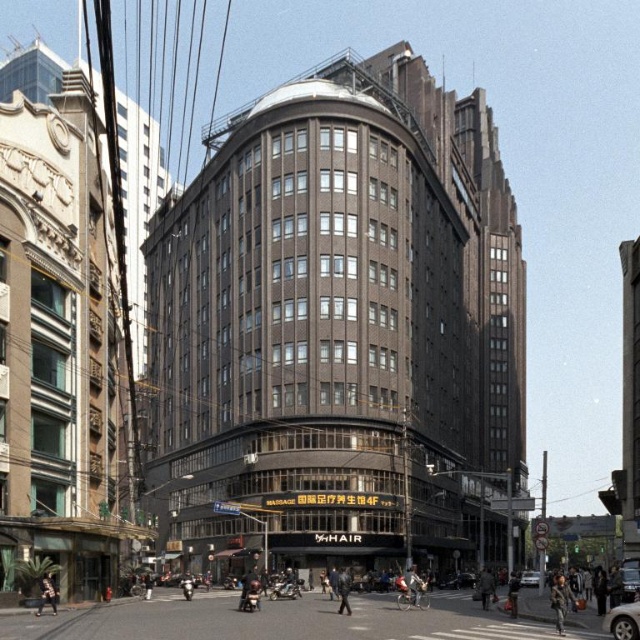
Question: Is denim jacket at lower center thinner than silver metallic car at center?

Choices:
 (A) no
 (B) yes

Answer: (B)

Question: Is denim jacket at center below denim jacket at lower center?

Choices:
 (A) no
 (B) yes

Answer: (B)

Question: Is dark brown leather jacket at lower left wider than khaki fabric jacket at center?

Choices:
 (A) yes
 (B) no

Answer: (B)

Question: Which of the following is the farthest from the observer?

Choices:
 (A) (508, 611)
 (B) (480, 576)
 (C) (48, 602)

Answer: (B)

Question: Which of the following is the closest to the observer?

Choices:
 (A) (420, 580)
 (B) (525, 576)
 (C) (618, 636)
 (D) (56, 593)

Answer: (C)

Question: Among these points, which one is nearest to the camera?

Choices:
 (A) (538, 582)
 (B) (604, 618)
 (C) (554, 600)

Answer: (B)